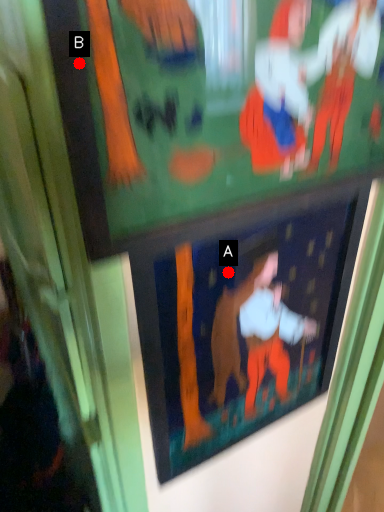
Question: Two points are circled on the image, labeled by A and B beside each circle. Which point is closer to the camera taking this photo?

Choices:
 (A) A is closer
 (B) B is closer

Answer: (B)